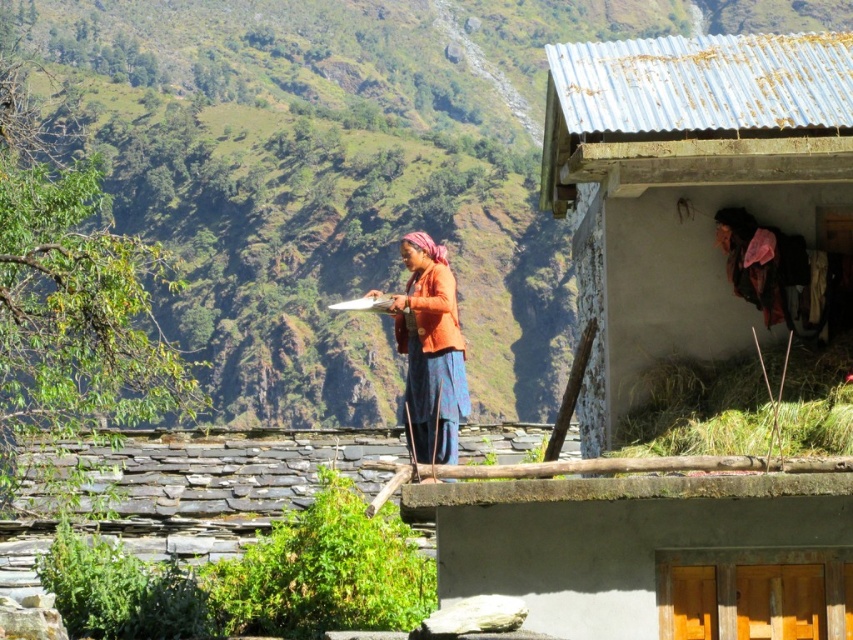
What is located at the coordinates point (x=704, y=408) in the image?

The green straw at lower right is located at point (x=704, y=408).

You are a photographer standing in the scene and want to take a picture of the orange fabric at center and the rusty corrugated metal hut at upper right. Which object should you place on the left side of your frame to ensure both are in the shot?

You should place the orange fabric at center on the left side of your frame because the rusty corrugated metal hut at upper right is positioned on the right side of orange fabric at center, so arranging them with orange fabric at center first from the left will include both in the shot.

You are standing at the center of the scene. Which direction should you look to see the green grassy hillside at upper left?

You should look to the upper left to see the green grassy hillside at upper left as it is located at point (341, 172).